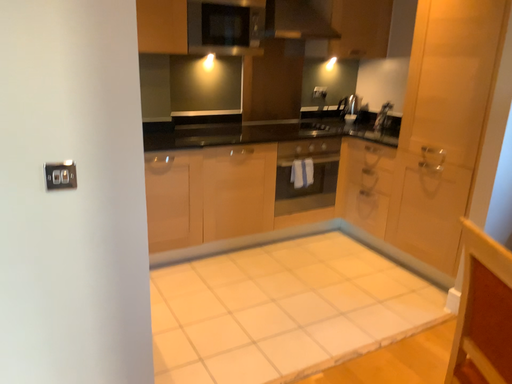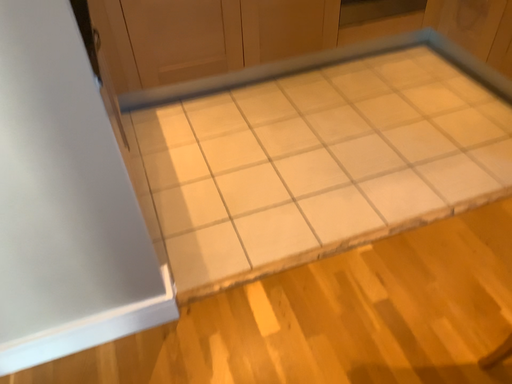
Question: How did the camera likely rotate when shooting the video?

Choices:
 (A) rotated left
 (B) rotated right

Answer: (A)